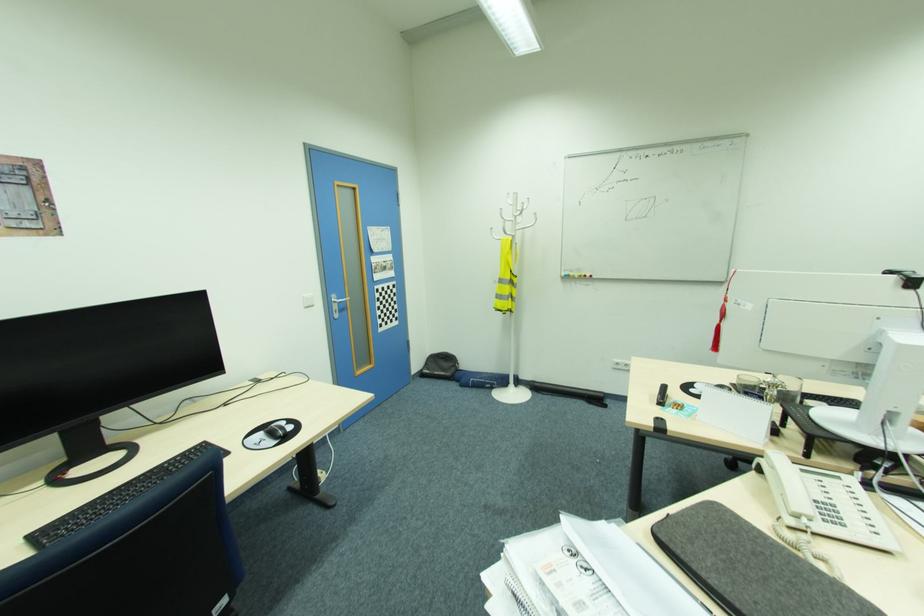
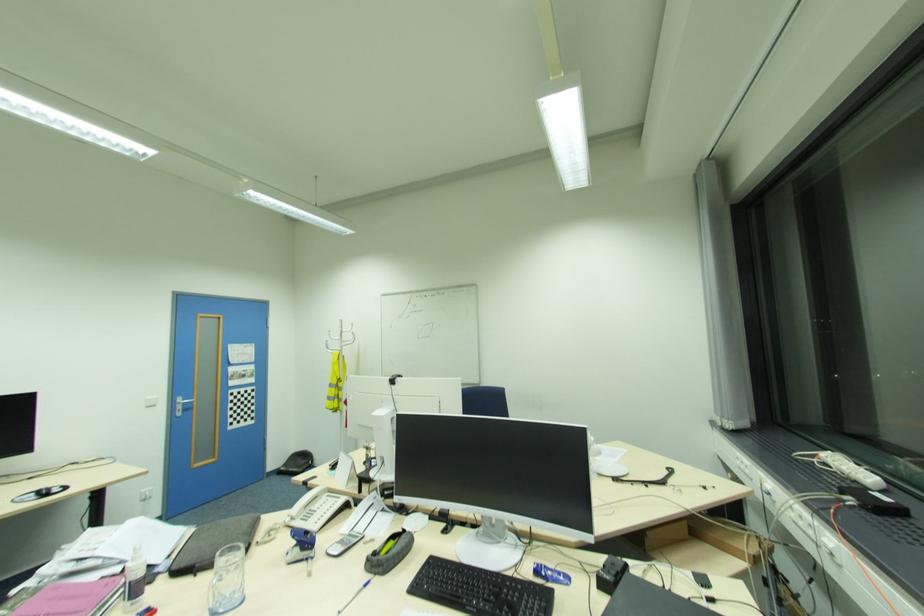
In the second image, find the point that corresponds to the point at 335,300 in the first image.

(180, 400)